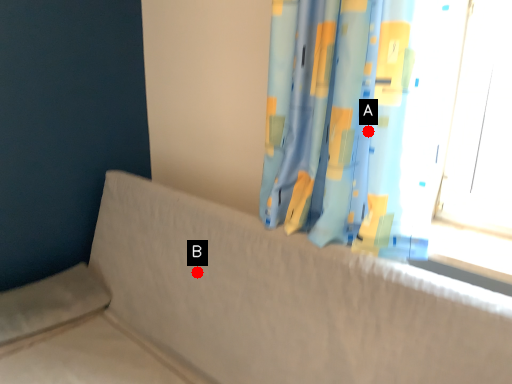
Question: Two points are circled on the image, labeled by A and B beside each circle. Which point is farther from the camera taking this photo?

Choices:
 (A) A is further
 (B) B is further

Answer: (B)